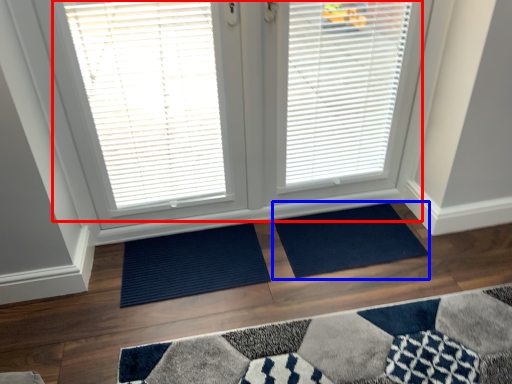
Question: Which object is closer to the camera taking this photo, bay window (highlighted by a red box) or doormat (highlighted by a blue box)?

Choices:
 (A) bay window
 (B) doormat

Answer: (A)